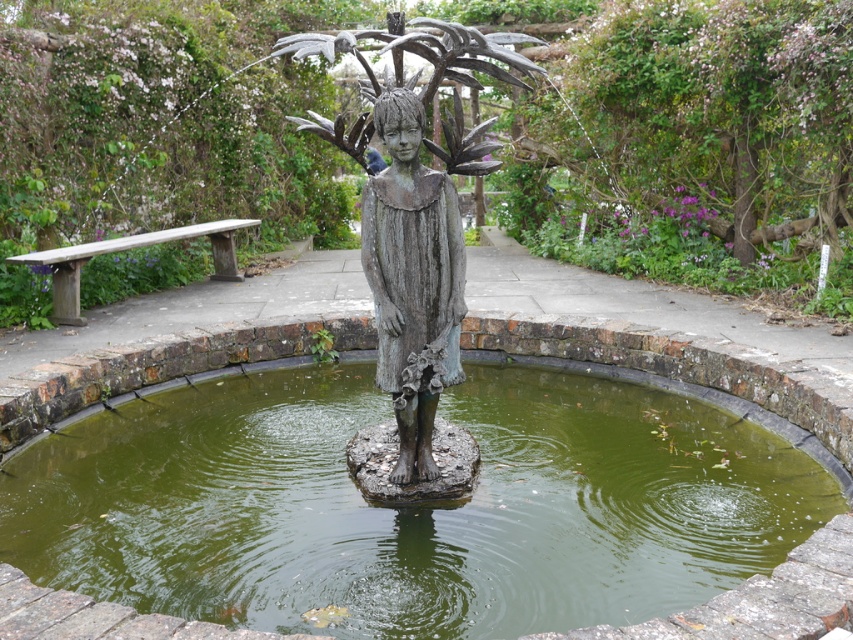
Who is positioned more to the left, rusty bronze statue at center or green murky water at center?

green murky water at center

Measure the distance between point (450, 216) and camera.

Point (450, 216) is 12.65 feet away from camera.

Find the location of a particular element. This screenshot has height=640, width=853. rusty bronze statue at center is located at coordinates (413, 212).